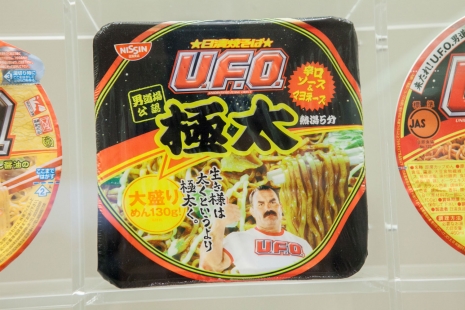
Image resolution: width=465 pixels, height=310 pixels. Find the location of `tan tile`. tan tile is located at coordinates (52, 22).